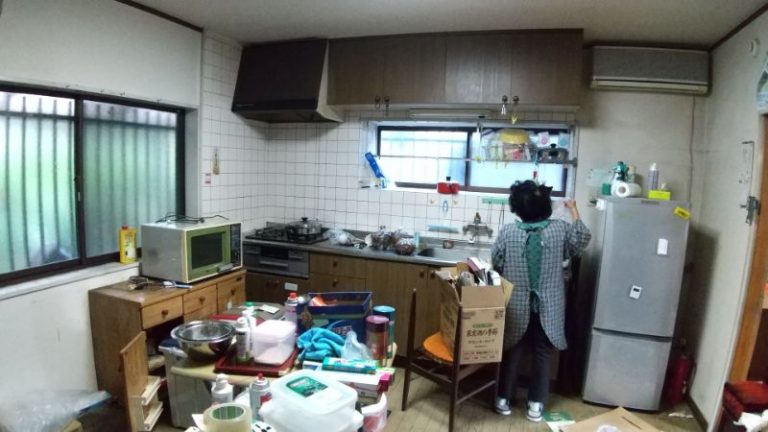
Identify the location of cabinet. The width and height of the screenshot is (768, 432). (389, 65).